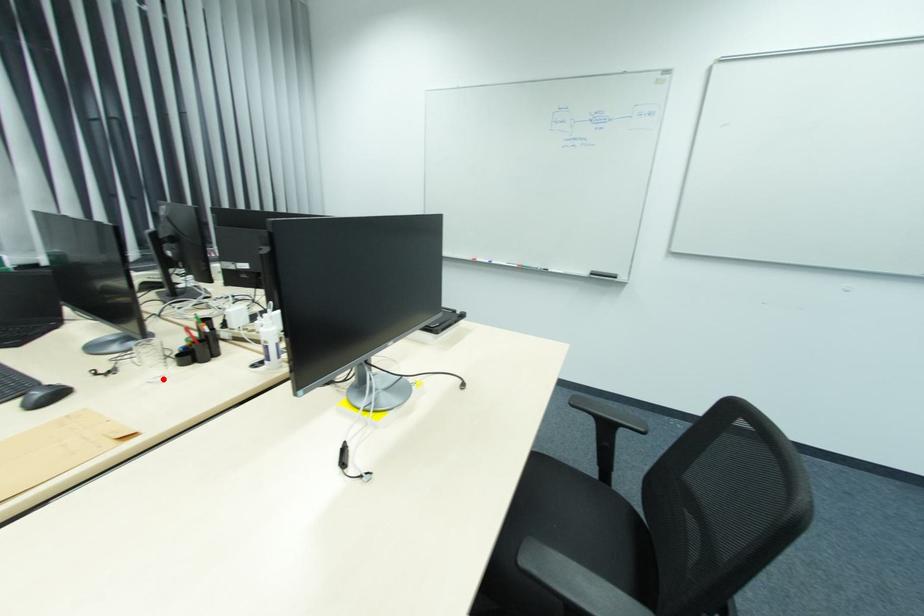
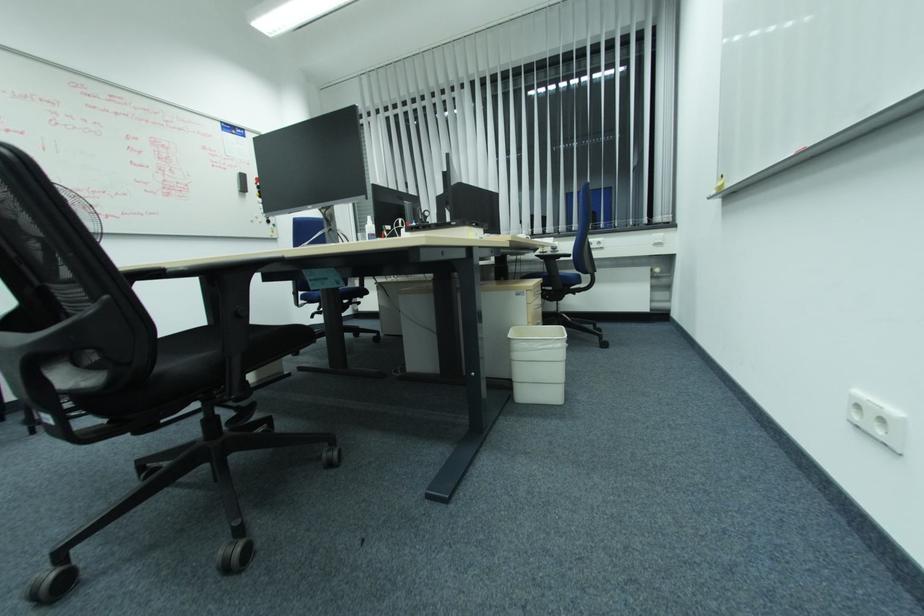
Question: I am providing you with two images of the same scene from different viewpoints. A red point is marked on the first image. Can you still see the location of the red point in image 2?

Choices:
 (A) Yes
 (B) No

Answer: (B)